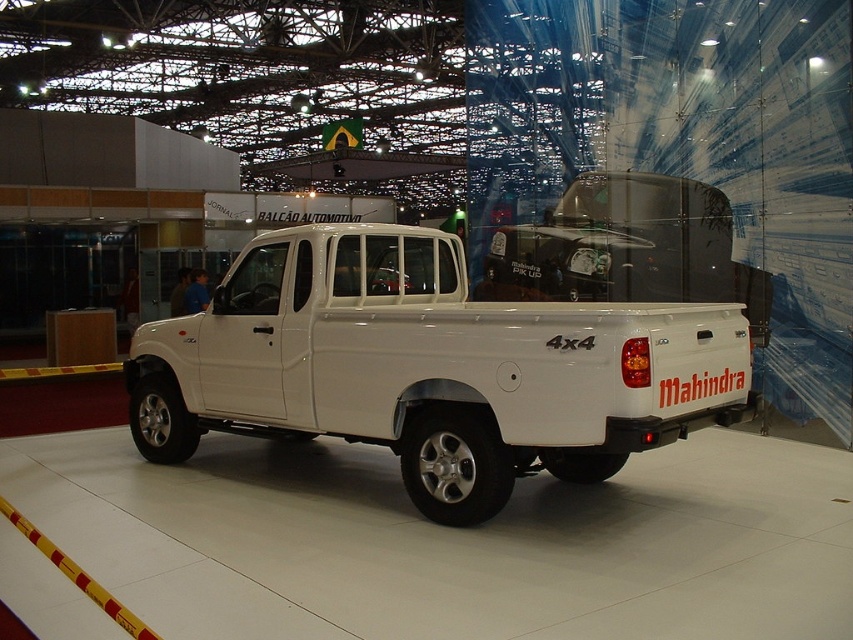
Question: Which point appears closest to the camera in this image?

Choices:
 (A) (465, 288)
 (B) (502, 268)

Answer: (A)

Question: Is white glossy pickup truck at center thinner than white matte truck at center?

Choices:
 (A) yes
 (B) no

Answer: (B)

Question: Which of the following is the closest to the observer?

Choices:
 (A) (602, 252)
 (B) (635, 428)

Answer: (B)

Question: Can you confirm if white glossy pickup truck at center is bigger than white matte truck at center?

Choices:
 (A) yes
 (B) no

Answer: (A)

Question: Is white glossy pickup truck at center above white matte truck at center?

Choices:
 (A) no
 (B) yes

Answer: (A)

Question: Which of the following is the closest to the observer?

Choices:
 (A) (766, 289)
 (B) (654, 314)

Answer: (B)